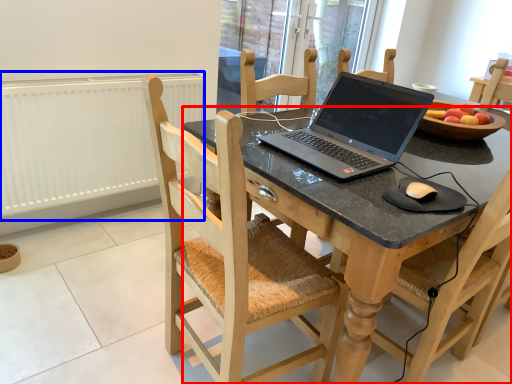
Question: Which of the following is the farthest to the observer, desk (highlighted by a red box) or radiator (highlighted by a blue box)?

Choices:
 (A) desk
 (B) radiator

Answer: (B)